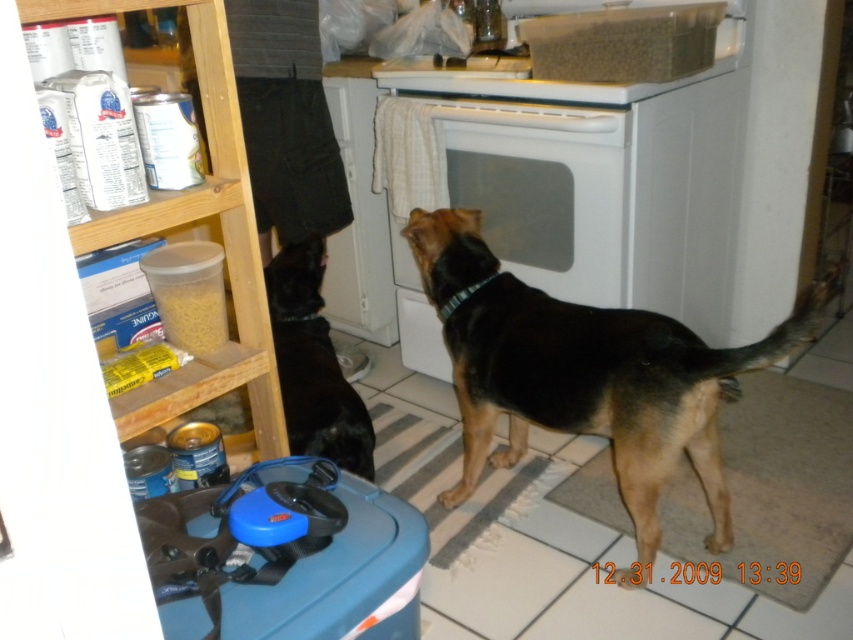
Which is more to the right, white matte oven at center or black fur dog at center?

white matte oven at center is more to the right.

The image size is (853, 640). What do you see at coordinates (508, 196) in the screenshot?
I see `white matte oven at center` at bounding box center [508, 196].

Where is `white matte oven at center`? The image size is (853, 640). white matte oven at center is located at coordinates (508, 196).

Who is lower down, brown fur dog at center or black fur dog at center?

brown fur dog at center is lower down.

What do you see at coordinates (587, 374) in the screenshot? I see `brown fur dog at center` at bounding box center [587, 374].

Identify the location of brown fur dog at center. (587, 374).

Which is below, brown fur dog at center or white matte oven at center?

brown fur dog at center

Which is more to the right, brown fur dog at center or white matte oven at center?

brown fur dog at center is more to the right.

This screenshot has height=640, width=853. What do you see at coordinates (587, 374) in the screenshot? I see `brown fur dog at center` at bounding box center [587, 374].

This screenshot has width=853, height=640. I want to click on brown fur dog at center, so click(x=587, y=374).